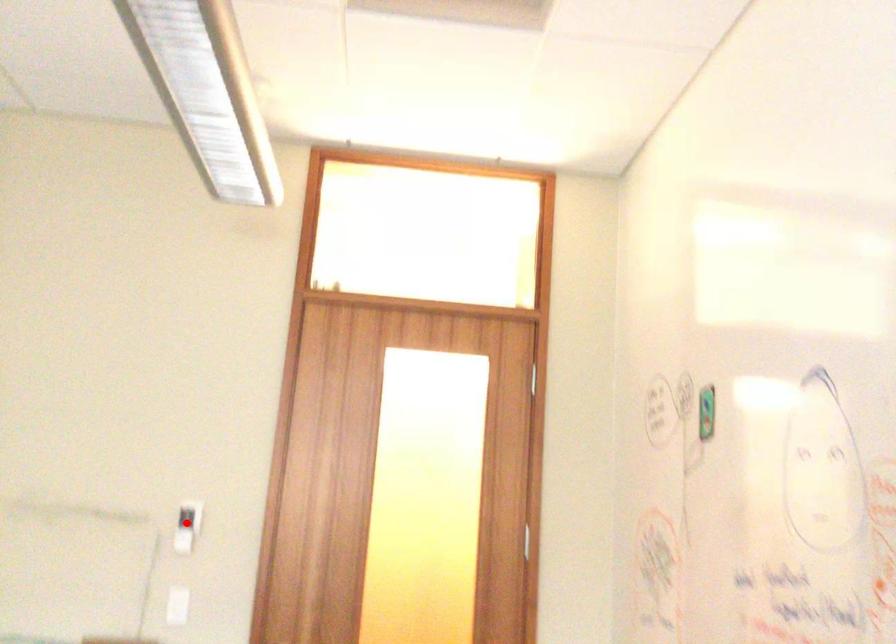
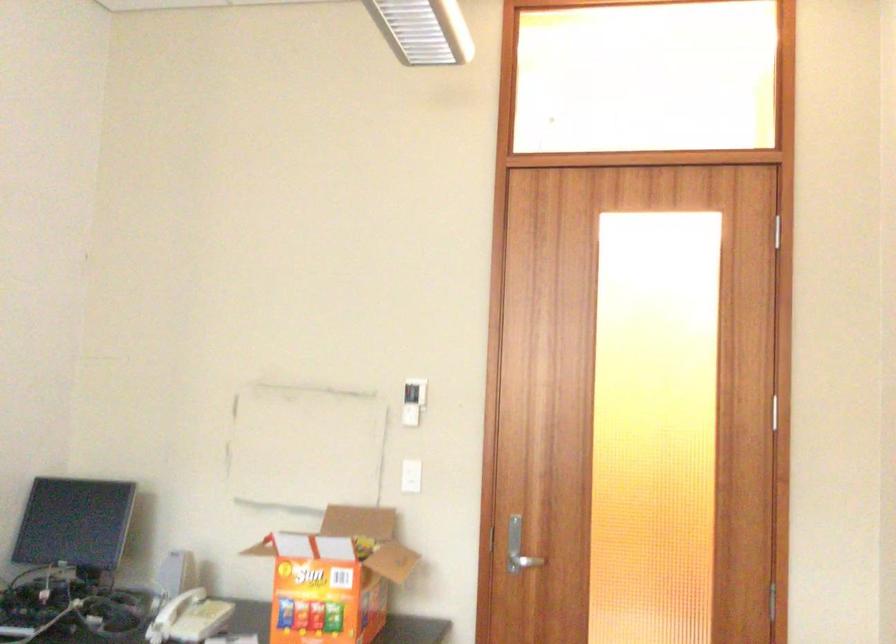
In the second image, find the point that corresponds to the highlighted location in the first image.

(412, 401)